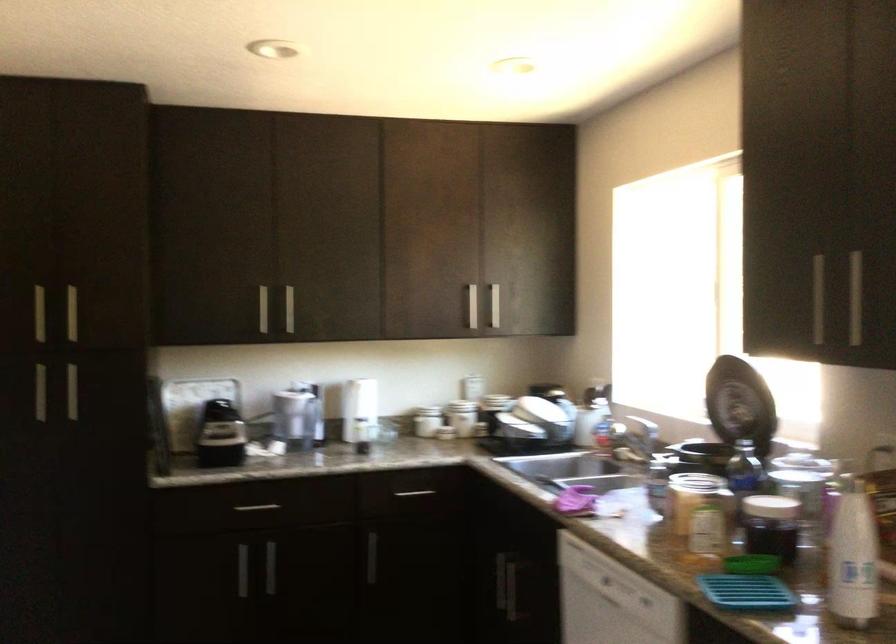
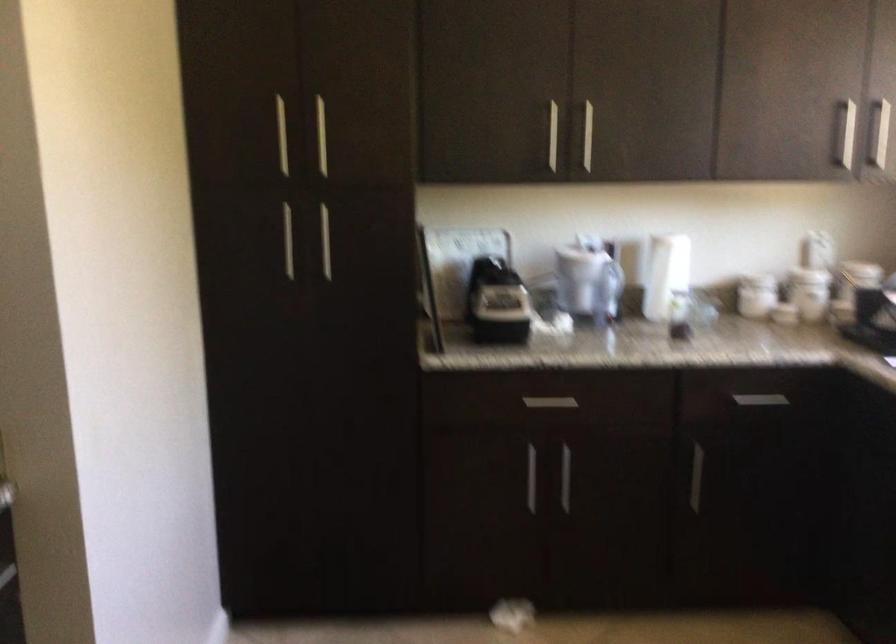
Locate, in the second image, the point that corresponds to (220,433) in the first image.

(496, 301)